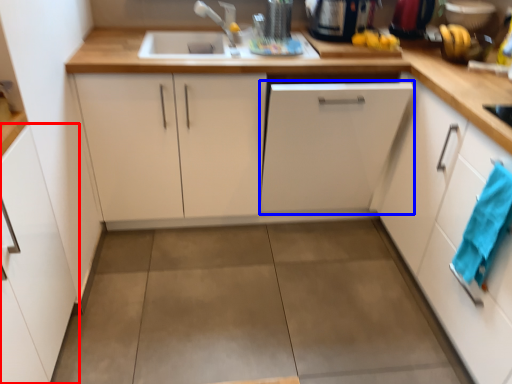
Question: Which of the following is the farthest to the observer, cabinetry (highlighted by a red box) or cabinetry (highlighted by a blue box)?

Choices:
 (A) cabinetry
 (B) cabinetry

Answer: (B)